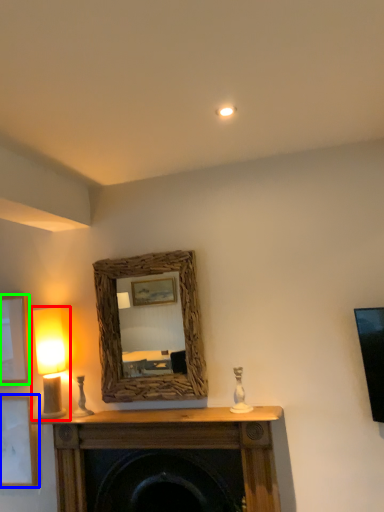
Question: Which is nearer to the table lamp (highlighted by a red box)? picture frame (highlighted by a blue box) or picture frame (highlighted by a green box).

Choices:
 (A) picture frame
 (B) picture frame

Answer: (B)